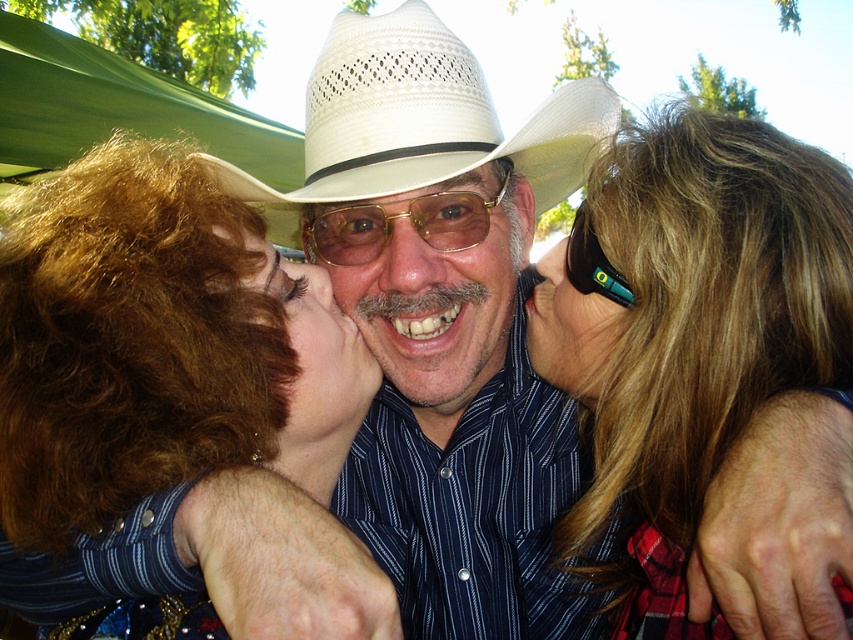
You are a photographer trying to capture a candid shot of the man in the middle. You notice the curly brown hair at center and the white woven straw cowboy hat at center. Which object is positioned higher on the man?

The curly brown hair at center is much taller than the white woven straw cowboy hat at center, so the curly brown hair at center is positioned higher on the man.